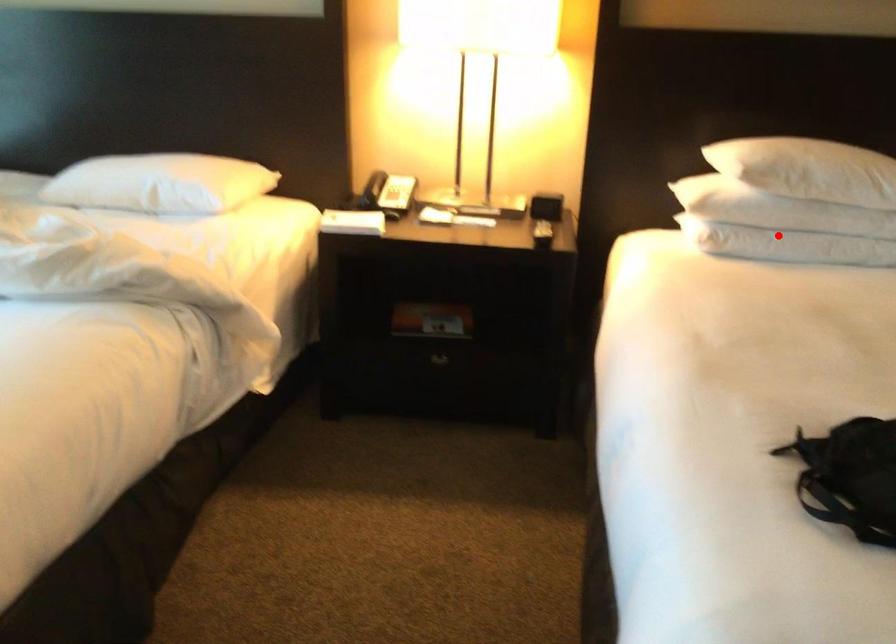
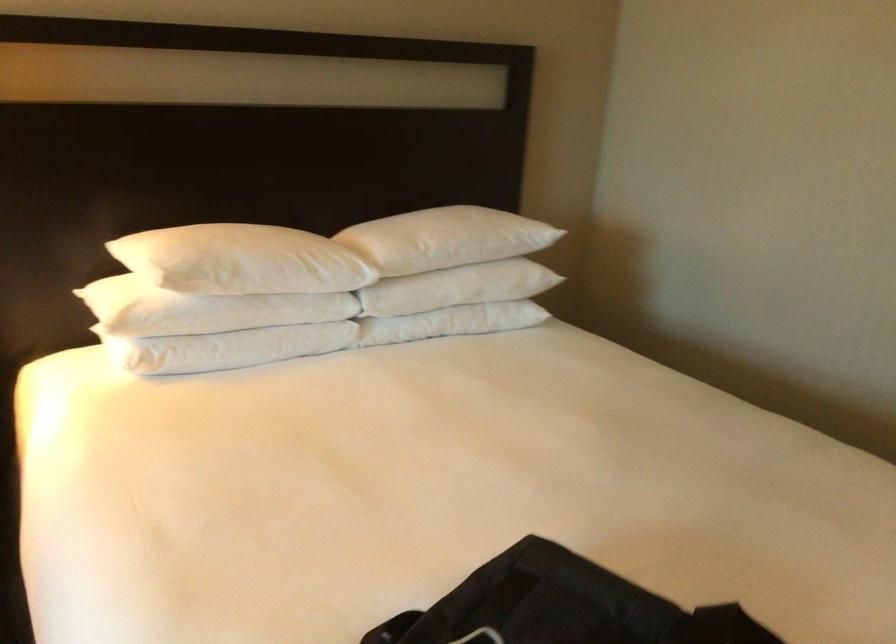
Question: I am providing you with two images of the same scene from different viewpoints. In image1, a red point is highlighted. Considering the same 3D point in image2, which of the following is correct?

Choices:
 (A) It is closer
 (B) It is farther

Answer: (A)